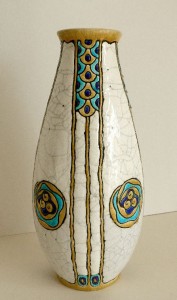
You are a GUI agent. You are given a task and a screenshot of the screen. Output one action in this format:
    pyautogui.click(x=<x>, y=<y>)
    Task: Click on the left vertical line on vase
    
    Given the screenshot: What is the action you would take?
    pyautogui.click(x=73, y=170)